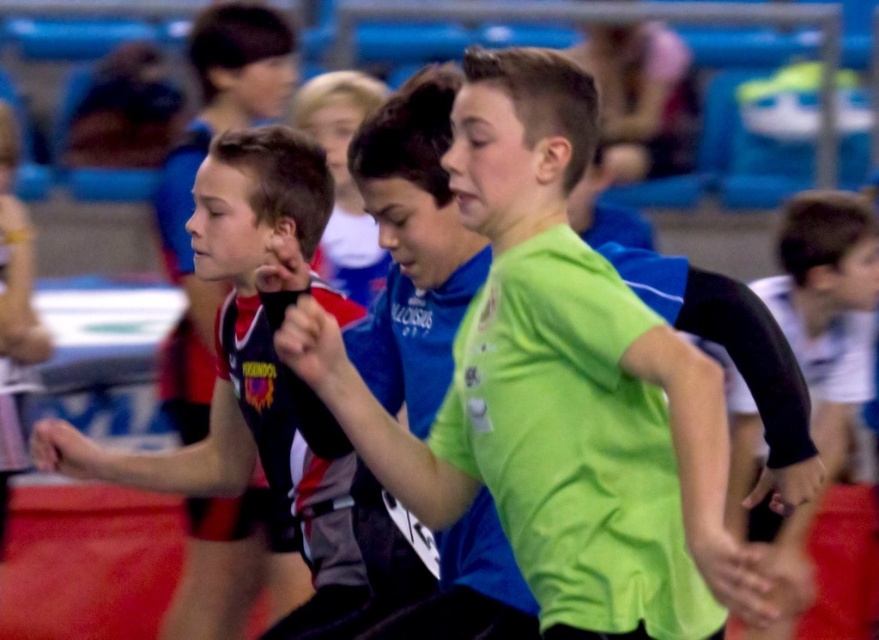
Question: Can you confirm if neon green jersey at center is bigger than matte black jersey at left?

Choices:
 (A) no
 (B) yes

Answer: (B)

Question: Does neon green jersey at center have a lesser width compared to matte black jersey at left?

Choices:
 (A) no
 (B) yes

Answer: (A)

Question: Can you confirm if neon green jersey at center is positioned to the right of matte black jersey at left?

Choices:
 (A) no
 (B) yes

Answer: (B)